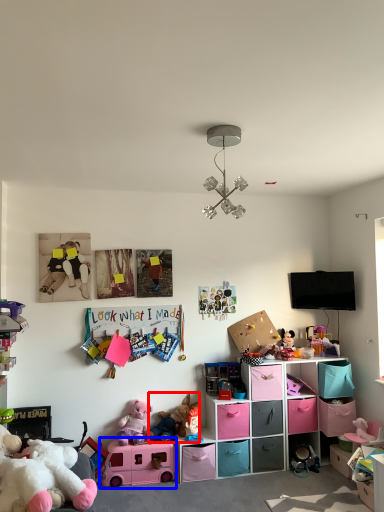
Question: Which point is closer to the camera, toy (highlighted by a red box) or toy (highlighted by a blue box)?

Choices:
 (A) toy
 (B) toy

Answer: (B)